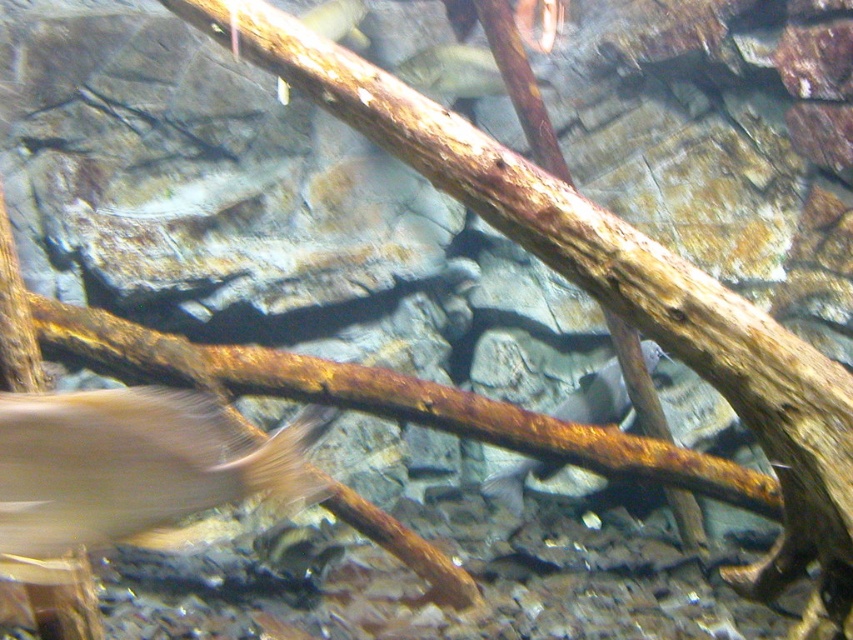
You are an underwater photographer aiming to capture both the translucent white fish at lower left and the translucent white fish at center in a single shot. Based on their positions, which fish should you focus on first to ensure both are in the frame?

The translucent white fish at lower left is located below the translucent white fish at center. To capture both in a single shot, focus on the translucent white fish at center first, as it is higher in the frame, allowing you to adjust the camera angle to include the lower fish without losing the upper one.

You are an underwater photographer aiming to capture both the translucent white fish at lower left and the silvery metallic fish at center in a single shot. Which fish should you focus on first to ensure both are in the frame?

You should focus on the silvery metallic fish at center first because the translucent white fish at lower left is positioned over it, meaning the white fish is closer to the camera. By focusing on the closer fish first, you can adjust your position to include both in the frame.

Looking at this image, you are an underwater photographer aiming to capture a clear image of both the silvery metallic fish at center and the translucent white fish at center. Which fish should you focus on first to ensure both are in focus?

You should focus on the silvery metallic fish at center first because it is closer to the viewer than the translucent white fish at center. By focusing on the closer fish, you can adjust the camera settings to ensure the farther fish remains in focus as well.